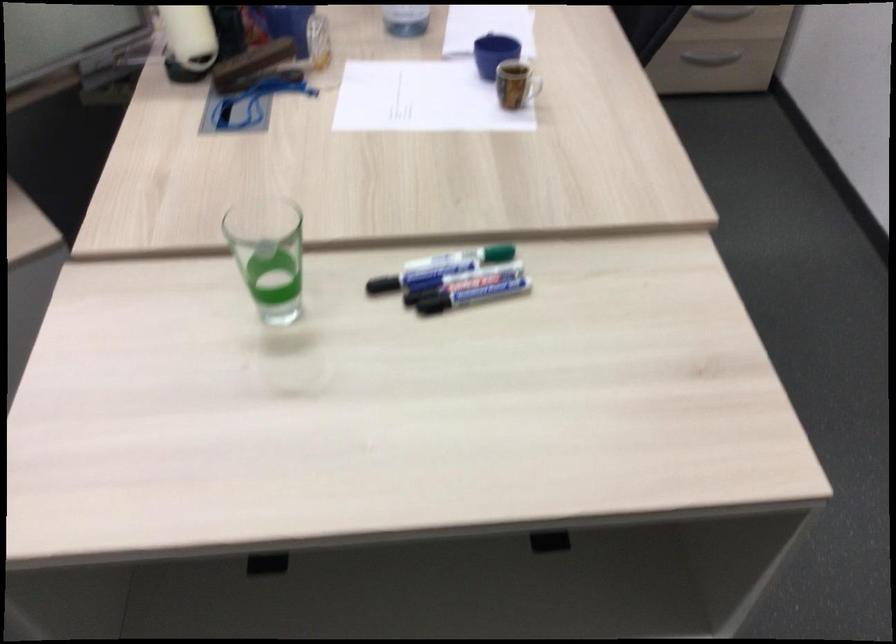
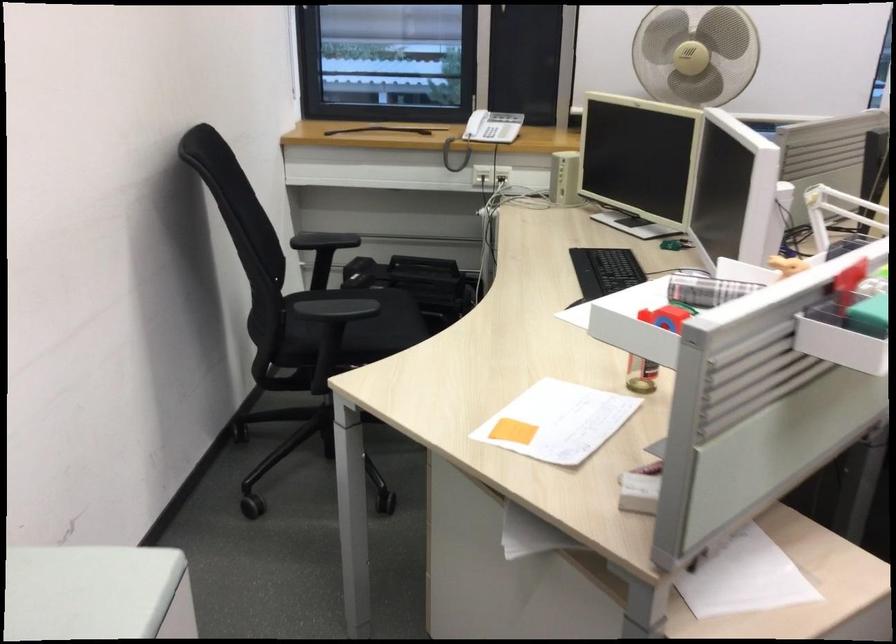
Question: Which direction would the cameraman need to move to produce the second image? Reply with the corresponding letter.

Choices:
 (A) Left
 (B) Right
 (C) Forward
 (D) Backward

Answer: (A)